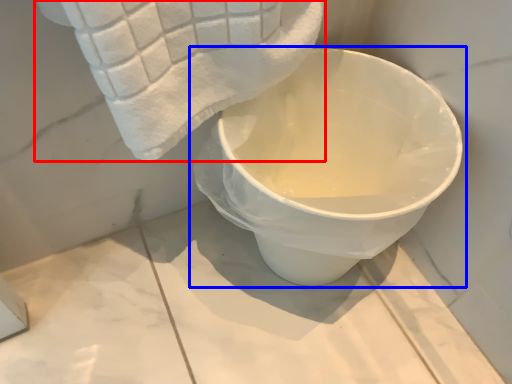
Question: Among these objects, which one is nearest to the camera, towel (highlighted by a red box) or toilet (highlighted by a blue box)?

Choices:
 (A) towel
 (B) toilet

Answer: (A)